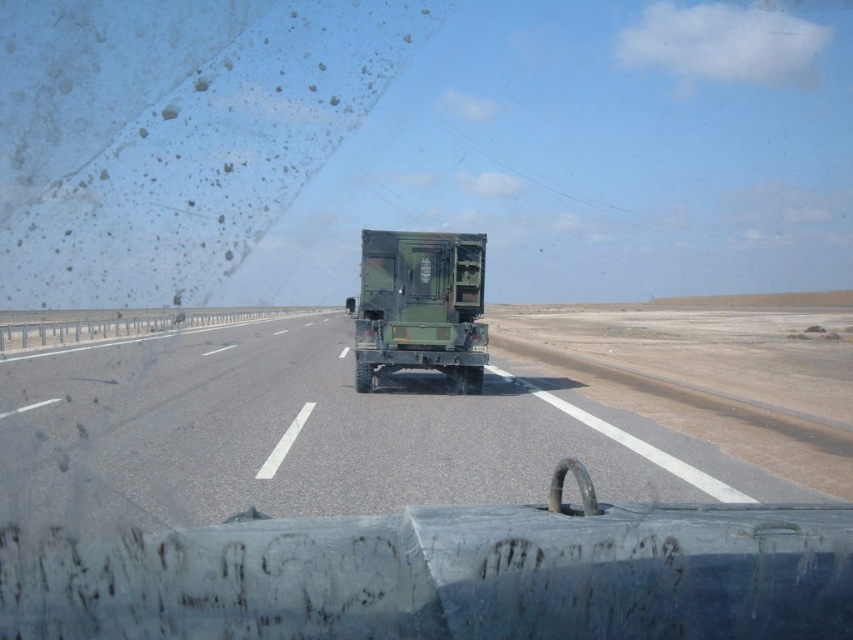
Who is lower down, gray asphalt highway at center or green matte trailer truck at center?

gray asphalt highway at center is below.

Is gray asphalt highway at center taller than green matte trailer truck at center?

In fact, gray asphalt highway at center may be shorter than green matte trailer truck at center.

Between point (328, 364) and point (355, 316), which one is positioned in front?

Positioned in front is point (355, 316).

Where is `gray asphalt highway at center`? The height and width of the screenshot is (640, 853). gray asphalt highway at center is located at coordinates pyautogui.click(x=314, y=433).